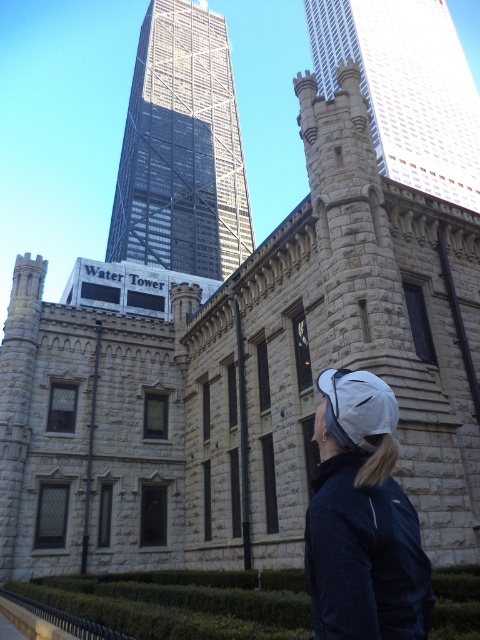
Who is taller, white matte cap at upper center or stone turret at upper center?

Standing taller between the two is stone turret at upper center.

Does white matte cap at upper center have a smaller size compared to stone turret at upper center?

Indeed, white matte cap at upper center has a smaller size compared to stone turret at upper center.

Image resolution: width=480 pixels, height=640 pixels. What are the coordinates of `white matte cap at upper center` in the screenshot? It's located at (362, 518).

Is reflective glass skyscraper at upper center to the left of white matte cap at upper center from the viewer's perspective?

Correct, you'll find reflective glass skyscraper at upper center to the left of white matte cap at upper center.

Can you confirm if reflective glass skyscraper at upper center is bigger than white matte cap at upper center?

Yes.

Between point (113, 205) and point (388, 458), which one is positioned in front?

Point (388, 458) is more forward.

This screenshot has width=480, height=640. Find the location of `reflective glass skyscraper at upper center`. reflective glass skyscraper at upper center is located at coordinates (181, 148).

Which of these two, reflective glass skyscraper at upper center or stone turret at upper center, stands taller?

stone turret at upper center is taller.

Does reflective glass skyscraper at upper center appear under stone turret at upper center?

Indeed, reflective glass skyscraper at upper center is positioned under stone turret at upper center.

Identify the location of reflective glass skyscraper at upper center. (181, 148).